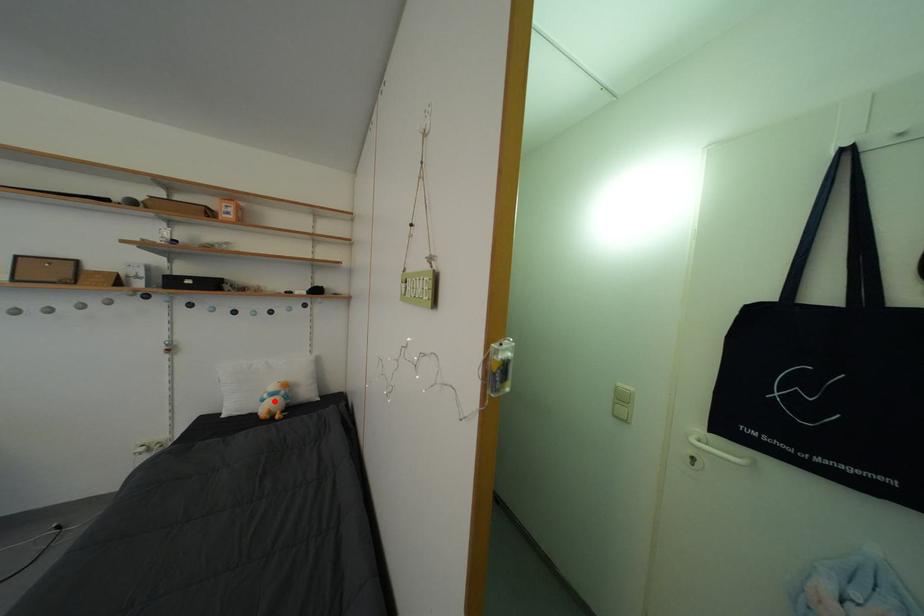
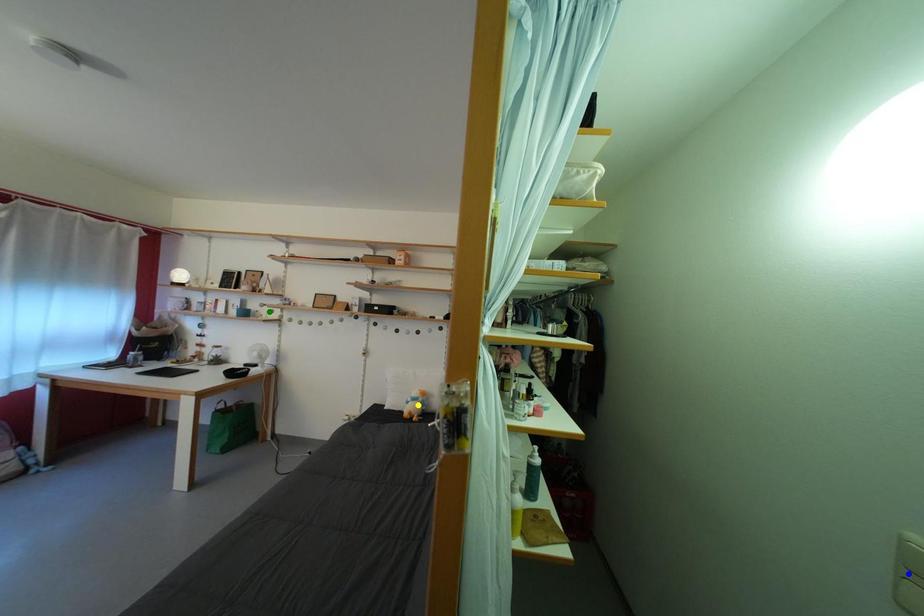
Question: I am providing you with two images of the same scene from different viewpoints. A red point is marked on the first image. You are given multiple points on the second image. Which mark in image 2 goes with the point in image 1?

Choices:
 (A) yellow point
 (B) blue point
 (C) green point

Answer: (A)